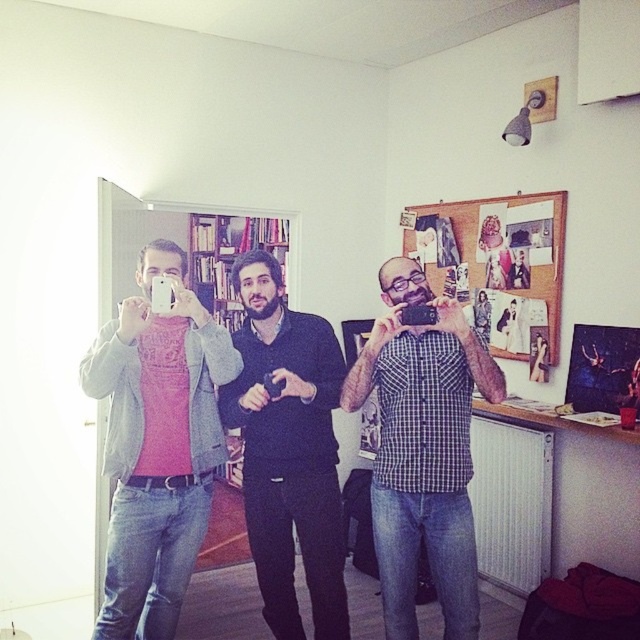
Question: Which of the following is the closest to the observer?

Choices:
 (A) (385, 628)
 (B) (177, 253)

Answer: (B)

Question: Is the position of checkered fabric shirt at center more distant than that of dark blue sweater at center?

Choices:
 (A) yes
 (B) no

Answer: (B)

Question: Does checkered fabric shirt at center appear under dark blue sweater at center?

Choices:
 (A) yes
 (B) no

Answer: (B)

Question: Which of the following is the closest to the observer?

Choices:
 (A) checkered fabric shirt at center
 (B) dark blue sweater at center

Answer: (A)

Question: Estimate the real-world distances between objects in this image. Which object is closer to the checkered fabric shirt at center?

Choices:
 (A) pink matte shirt at center
 (B) dark blue sweater at center

Answer: (B)

Question: Is checkered fabric shirt at center wider than dark blue sweater at center?

Choices:
 (A) no
 (B) yes

Answer: (B)